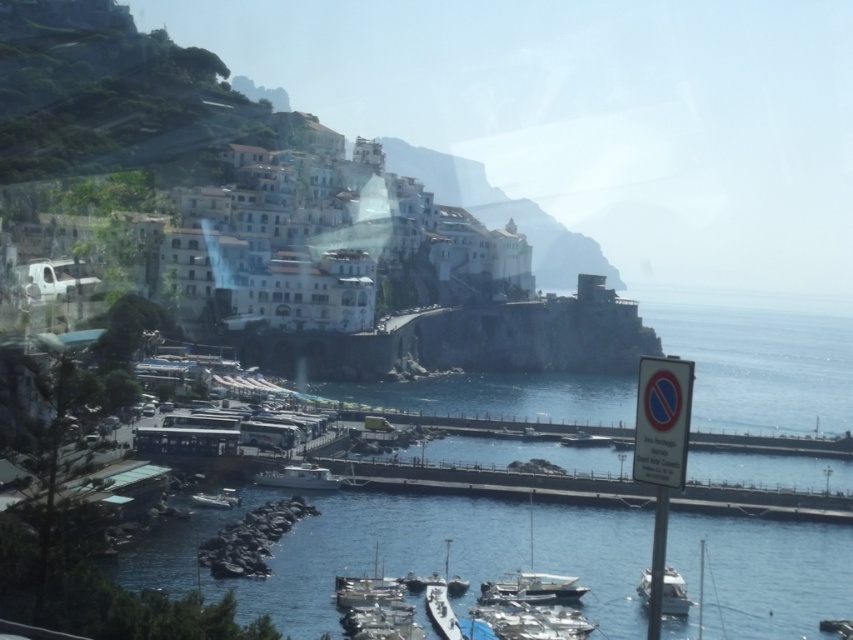
Question: Which object is closer to the camera taking this photo?

Choices:
 (A) white glossy boat at center
 (B) white glossy boat at lower right

Answer: (B)

Question: Is white glossy sailboat at lower center to the left of white glossy boat at center from the viewer's perspective?

Choices:
 (A) yes
 (B) no

Answer: (B)

Question: From the image, what is the correct spatial relationship of white glossy sailboat at lower center in relation to white glossy boat at center?

Choices:
 (A) left
 (B) right

Answer: (B)

Question: Which object is the farthest from the white glossy sailboat at lower center?

Choices:
 (A) white glossy boat at lower right
 (B) white glossy boat at center

Answer: (B)

Question: Does white glossy sailboat at lower center have a greater width compared to white glossy boat at lower right?

Choices:
 (A) no
 (B) yes

Answer: (A)

Question: Which object is farther from the camera taking this photo?

Choices:
 (A) white glossy boat at center
 (B) white glossy sailboat at lower center

Answer: (A)